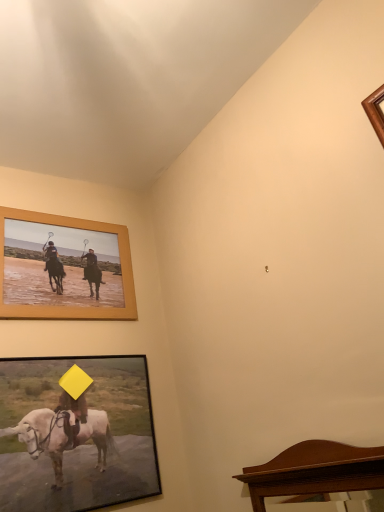
Question: Is wooden-framed picture at lower left, the first picture frame in the bottom-to-top sequence, wider or thinner than wooden frame at upper left, which appears as the 1th picture frame when viewed from the top?

Choices:
 (A) wide
 (B) thin

Answer: (A)

Question: Is point (61, 483) closer or farther from the camera than point (125, 259)?

Choices:
 (A) closer
 (B) farther

Answer: (A)

Question: Which of these objects is positioned farthest from the wooden-framed picture at lower left, the first picture frame in the bottom-to-top sequence?

Choices:
 (A) wooden frame at upper left, which appears as the 1th picture frame when viewed from the top
 (B) mahogany wood mirror at lower right

Answer: (B)

Question: Which is nearer to the wooden-framed picture at lower left, arranged as the second picture frame when viewed from the top?

Choices:
 (A) wooden frame at upper left, which appears as the 1th picture frame when viewed from the top
 (B) mahogany wood mirror at lower right

Answer: (A)